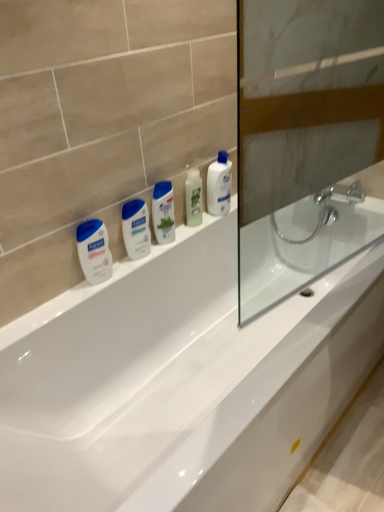
Question: Considering the relative positions of white glossy mouthwash at center, positioned as the second mouthwash in left-to-right order, and white glossy lotion at left, which is the fourth mouthwash in right-to-left order, in the image provided, is white glossy mouthwash at center, positioned as the second mouthwash in left-to-right order, to the left or to the right of white glossy lotion at left, which is the fourth mouthwash in right-to-left order,?

Choices:
 (A) right
 (B) left

Answer: (A)

Question: Does point (125, 249) appear closer or farther from the camera than point (92, 274)?

Choices:
 (A) closer
 (B) farther

Answer: (B)

Question: Estimate the real-world distances between objects in this image. Which object is farther from the white glossy mouthwash at center, which is the first mouthwash in right-to-left order?

Choices:
 (A) white glossy lotion at left, which is the fourth mouthwash in right-to-left order
 (B) white glossy mouthwash at center, positioned as the second mouthwash in left-to-right order
 (C) white plastic bottle at center
 (D) green matte mouthwash at center, which ranks as the third mouthwash in left-to-right order
 (E) white glossy bathtub at center

Answer: (E)

Question: Estimate the real-world distances between objects in this image. Which object is farther from the green matte mouthwash at center, marked as the 2th mouthwash in a right-to-left arrangement?

Choices:
 (A) white glossy bathtub at center
 (B) white plastic bottle at center
 (C) white glossy mouthwash at center, which is the first mouthwash in right-to-left order
 (D) white glossy mouthwash at center, positioned as the second mouthwash in left-to-right order
 (E) white glossy lotion at left, which is the fourth mouthwash in right-to-left order

Answer: (A)